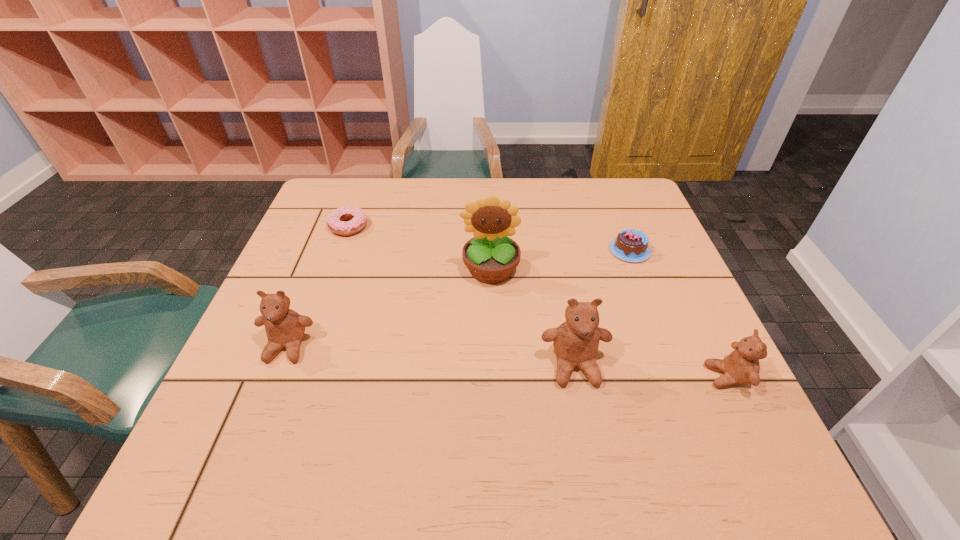
I want to click on blank region between the second shortest teddy bear and the second shortest object, so click(459, 299).

Locate an element on the screen. vacant area that lies between the leftmost teddy bear and the doughnut is located at coordinates (318, 287).

Locate an element on the screen. The height and width of the screenshot is (540, 960). object that is the fourth closest one to the doughnut is located at coordinates (630, 245).

Choose which object is the second nearest neighbor to the rightmost teddy bear. Please provide its 2D coordinates. Your answer should be formatted as a tuple, i.e. [(x, y)], where the tuple contains the x and y coordinates of a point satisfying the conditions above.

[(630, 245)]

Locate which teddy bear ranks second in proximity to the chocolate cake. Please provide its 2D coordinates. Your answer should be formatted as a tuple, i.e. [(x, y)], where the tuple contains the x and y coordinates of a point satisfying the conditions above.

[(741, 366)]

Point out which teddy bear is positioned as the nearest to the second teddy bear from left to right. Please provide its 2D coordinates. Your answer should be formatted as a tuple, i.e. [(x, y)], where the tuple contains the x and y coordinates of a point satisfying the conditions above.

[(741, 366)]